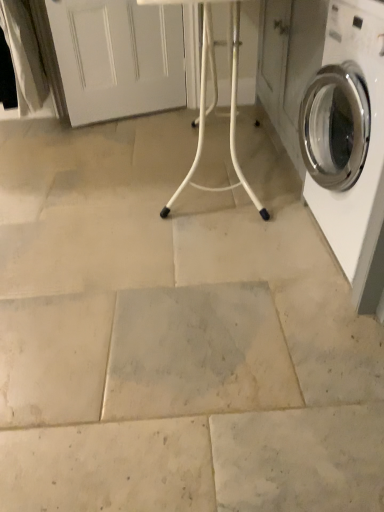
Question: From a real-world perspective, does white glossy washing machine at right stand above white plastic table at center?

Choices:
 (A) yes
 (B) no

Answer: (B)

Question: Could you tell me if white glossy washing machine at right is turned towards white plastic table at center?

Choices:
 (A) yes
 (B) no

Answer: (B)

Question: Considering the relative sizes of white glossy washing machine at right and white plastic table at center in the image provided, is white glossy washing machine at right thinner than white plastic table at center?

Choices:
 (A) no
 (B) yes

Answer: (B)

Question: Is the position of white glossy washing machine at right more distant than that of white plastic table at center?

Choices:
 (A) no
 (B) yes

Answer: (A)

Question: Considering the relative sizes of white glossy washing machine at right and white plastic table at center in the image provided, is white glossy washing machine at right taller than white plastic table at center?

Choices:
 (A) no
 (B) yes

Answer: (A)

Question: Does white glossy washing machine at right appear on the right side of white plastic table at center?

Choices:
 (A) yes
 (B) no

Answer: (A)

Question: Can you confirm if white plastic table at center is shorter than white glossy washing machine at right?

Choices:
 (A) no
 (B) yes

Answer: (A)

Question: Would you consider white plastic table at center to be distant from white glossy washing machine at right?

Choices:
 (A) no
 (B) yes

Answer: (A)

Question: From the image's perspective, would you say white plastic table at center is positioned over white glossy washing machine at right?

Choices:
 (A) no
 (B) yes

Answer: (B)

Question: Would you say white plastic table at center contains white glossy washing machine at right?

Choices:
 (A) yes
 (B) no

Answer: (B)

Question: Is white plastic table at center at the right side of white glossy washing machine at right?

Choices:
 (A) yes
 (B) no

Answer: (B)

Question: Can you confirm if white plastic table at center is smaller than white glossy washing machine at right?

Choices:
 (A) no
 (B) yes

Answer: (A)

Question: Choose the correct answer: Is white glossy washing machine at right inside white plastic table at center or outside it?

Choices:
 (A) outside
 (B) inside

Answer: (A)